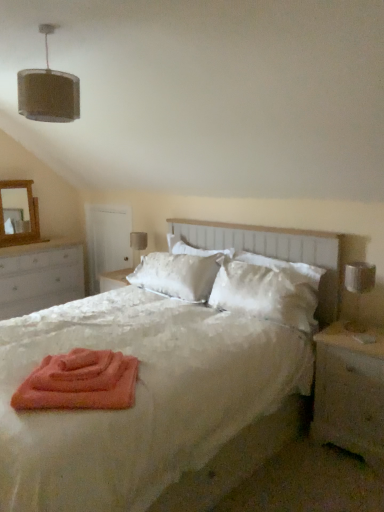
Question: Is silver metallic table lamp at right, the first table lamp when ordered from right to left, wider or thinner than wooden nightstand at right, the 2th nightstand viewed from the back?

Choices:
 (A) wide
 (B) thin

Answer: (B)

Question: Does point (344, 270) appear closer or farther from the camera than point (322, 400)?

Choices:
 (A) closer
 (B) farther

Answer: (B)

Question: Which object is the closest to the soft coral bath towel at center?

Choices:
 (A) satin white pillow at center
 (B) white wood dresser at left, the 2th nightstand positioned from the right
 (C) wooden nightstand at right, which is the first nightstand from right to left
 (D) satin beige table lamp at center, arranged as the first table lamp when viewed from the left
 (E) silver metallic table lamp at right, which is the 2th table lamp in back-to-front order

Answer: (A)

Question: Based on their relative distances, which object is nearer to the silver metallic table lamp at right, placed as the first table lamp when sorted from front to back?

Choices:
 (A) white wood dresser at left, the 2th nightstand positioned from the right
 (B) brown fabric lampshade at upper left
 (C) white satin bed at center
 (D) white satin headboard at center
 (E) soft coral bath towel at center

Answer: (D)